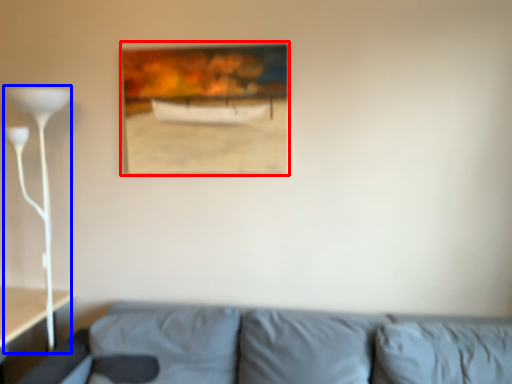
Question: Which point is closer to the camera, picture frame (highlighted by a red box) or table lamp (highlighted by a blue box)?

Choices:
 (A) picture frame
 (B) table lamp

Answer: (B)